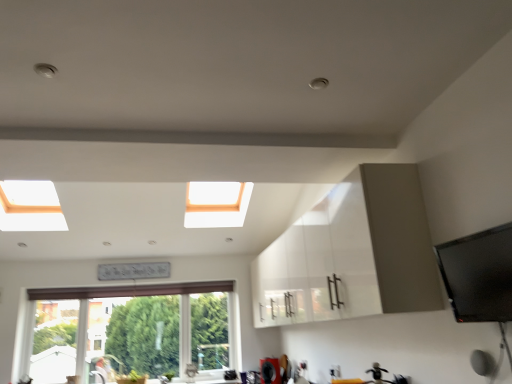
What is the approximate height of matte silver faucet at lower center?

matte silver faucet at lower center is 6.03 inches in height.

This screenshot has height=384, width=512. I want to click on white frame window at lower left, so click(129, 290).

What do you see at coordinates (352, 254) in the screenshot? This screenshot has width=512, height=384. I see `white glossy cabinet at center` at bounding box center [352, 254].

I want to click on matte silver faucet at lower center, so click(164, 379).

Could you tell me if matte silver faucet at lower center is turned towards white glossy cabinet at center?

No, matte silver faucet at lower center is not aimed at white glossy cabinet at center.

Considering the sizes of matte silver faucet at lower center and white glossy cabinet at center in the image, is matte silver faucet at lower center bigger or smaller than white glossy cabinet at center?

Considering their sizes, matte silver faucet at lower center takes up less space than white glossy cabinet at center.

Considering the points (167, 382) and (390, 175), which point is behind, point (167, 382) or point (390, 175)?

The point (167, 382) is farther from the camera.

Is there a large distance between matte silver faucet at lower center and white glossy cabinet at center?

matte silver faucet at lower center is positioned a significant distance from white glossy cabinet at center.

Is white glossy cabinet at center facing away from white frame window at lower left?

→ No, white glossy cabinet at center is not facing the opposite direction of white frame window at lower left.

From the picture: Considering the relative sizes of white glossy cabinet at center and white frame window at lower left in the image provided, is white glossy cabinet at center bigger than white frame window at lower left?

Yes, white glossy cabinet at center is bigger than white frame window at lower left.

Is point (158, 378) positioned before point (113, 287)?

That is False.

Which object is positioned more to the right, matte silver faucet at lower center or white frame window at lower left?

Positioned to the right is matte silver faucet at lower center.

Is white frame window at lower left at the back of matte silver faucet at lower center?

Yes.

Who is taller, matte silver faucet at lower center or white frame window at lower left?

Standing taller between the two is white frame window at lower left.

In the scene shown: Relative to white glossy cabinet at center, is white frame window at lower left in front or behind?

In the image, white frame window at lower left appears behind white glossy cabinet at center.

You are a GUI agent. You are given a task and a screenshot of the screen. Output one action in this format:
    pyautogui.click(x=<x>, y=<y>)
    Task: Click on the cabinetry in front of the white frame window at lower left
    The width and height of the screenshot is (512, 384).
    Given the screenshot: What is the action you would take?
    pyautogui.click(x=352, y=254)

In the scene shown: Could you tell me if white frame window at lower left is turned towards white glossy cabinet at center?

Yes, white frame window at lower left is oriented towards white glossy cabinet at center.

Between white frame window at lower left and white glossy cabinet at center, which one has larger size?

white glossy cabinet at center.

Would you say white frame window at lower left is outside matte silver faucet at lower center?

Yes, white frame window at lower left is outside of matte silver faucet at lower center.

Between white frame window at lower left and matte silver faucet at lower center, which one has larger size?

white frame window at lower left.

Does white frame window at lower left have a lesser width compared to matte silver faucet at lower center?

Yes.

Can you confirm if white frame window at lower left is positioned to the left of matte silver faucet at lower center?

Correct, you'll find white frame window at lower left to the left of matte silver faucet at lower center.

Does white glossy cabinet at center turn towards matte silver faucet at lower center?

No, white glossy cabinet at center is not oriented towards matte silver faucet at lower center.

Which point is more distant from viewer, (x=298, y=277) or (x=161, y=376)?

Positioned behind is point (x=161, y=376).

Is white glossy cabinet at center next to matte silver faucet at lower center?

white glossy cabinet at center is not next to matte silver faucet at lower center, and they're not touching.

Locate an element on the screen. cabinetry above the matte silver faucet at lower center (from the image's perspective) is located at coordinates (352, 254).

Locate an element on the screen. This screenshot has width=512, height=384. faucet behind the white glossy cabinet at center is located at coordinates (164, 379).

I want to click on cabinetry in front of the white frame window at lower left, so click(352, 254).

Based on their spatial positions, is matte silver faucet at lower center or white frame window at lower left further from white glossy cabinet at center?

matte silver faucet at lower center is positioned further to the anchor white glossy cabinet at center.

Based on their spatial positions, is white frame window at lower left or matte silver faucet at lower center closer to white glossy cabinet at center?

white frame window at lower left is closer to white glossy cabinet at center.

When comparing their distances from matte silver faucet at lower center, does white frame window at lower left or white glossy cabinet at center seem further?

white glossy cabinet at center is further to matte silver faucet at lower center.

Looking at this image, which object lies further to the anchor point matte silver faucet at lower center, white glossy cabinet at center or white frame window at lower left?

white glossy cabinet at center.

Based on their spatial positions, is matte silver faucet at lower center or white glossy cabinet at center further from white frame window at lower left?

white glossy cabinet at center is positioned further to the anchor white frame window at lower left.

Based on their spatial positions, is white glossy cabinet at center or matte silver faucet at lower center closer to white frame window at lower left?

The object closer to white frame window at lower left is matte silver faucet at lower center.

The height and width of the screenshot is (384, 512). In order to click on faucet between white glossy cabinet at center and white frame window at lower left from front to back in this screenshot , I will do `click(164, 379)`.